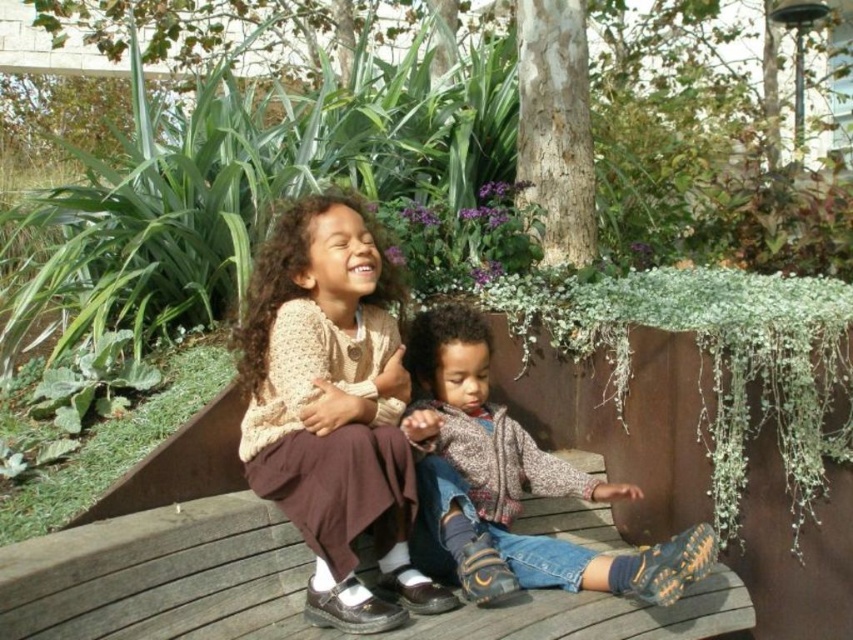
You are a tailor observing two children sitting on a wooden bench. You notice the knitted beige sweater at center and the knitted sweater at center. Which of these two sweaters takes up less space?

The knitted beige sweater at center occupies less space than the knitted sweater at center.

You are standing at the position of the point at coordinates point [316,406] and want to walk towards the point at coordinates point [659,576]. Given that there is a wooden bench between you and the target point, will you need to go around it?

Since point [316,406] is in front of point [659,576], the wooden bench is between you and the target point. Therefore, you will need to go around it to reach the destination.